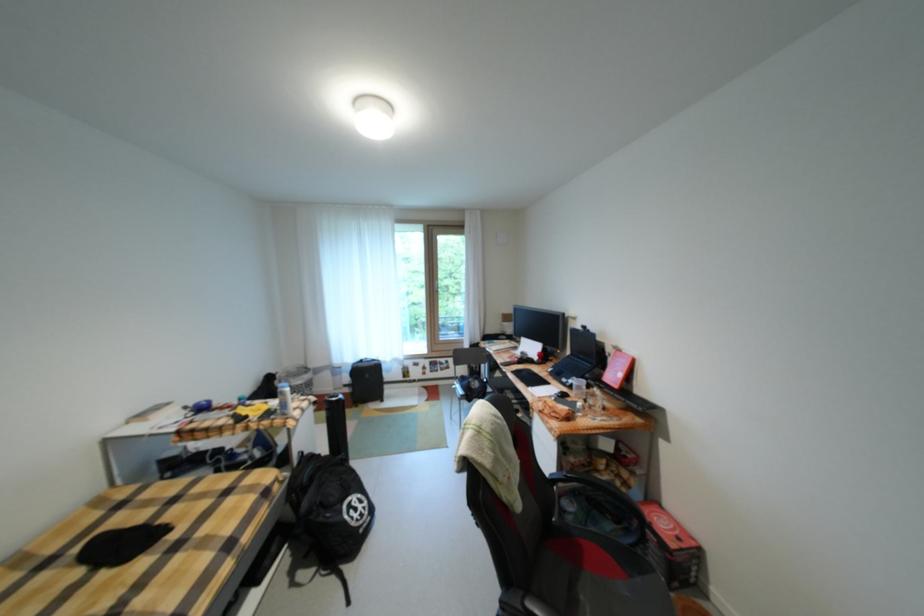
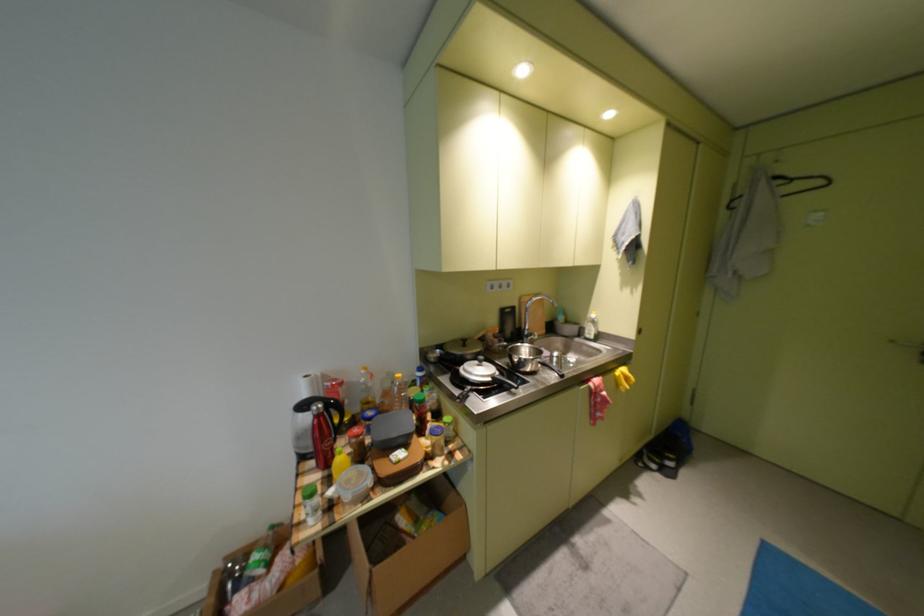
Question: The images are taken continuously from a first-person perspective. In which direction is your viewpoint rotating?

Choices:
 (A) Left
 (B) Right
 (C) Up
 (D) Down

Answer: (B)